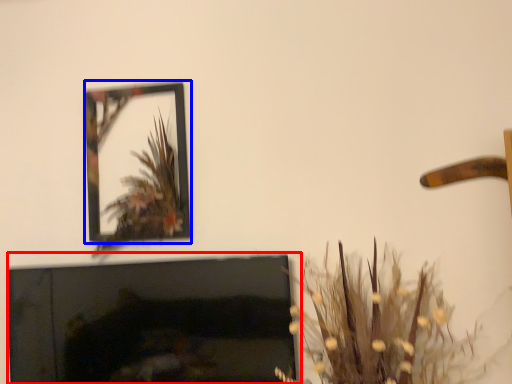
Question: Which object appears closest to the camera in this image, fireplace (highlighted by a red box) or picture frame (highlighted by a blue box)?

Choices:
 (A) fireplace
 (B) picture frame

Answer: (A)